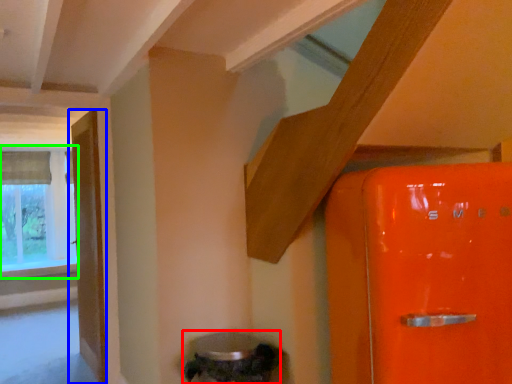
Question: Estimate the real-world distances between objects in this image. Which object is farther from water heater (highlighted by a red box), door (highlighted by a blue box) or window (highlighted by a green box)?

Choices:
 (A) door
 (B) window

Answer: (B)